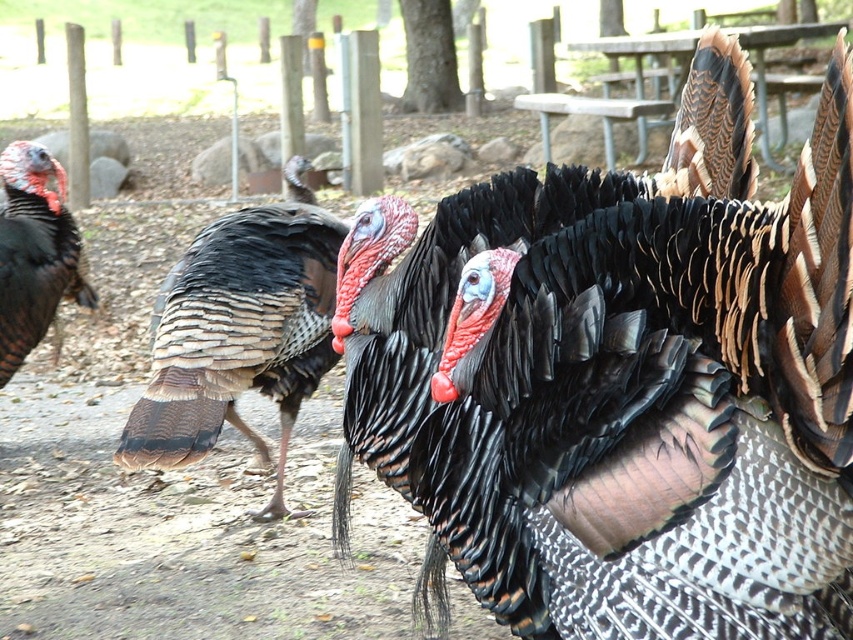
Question: Is shiny black feathers at center closer to camera compared to matte black turkey at left?

Choices:
 (A) no
 (B) yes

Answer: (B)

Question: Which object is closer to the camera taking this photo?

Choices:
 (A) shiny black feathers at center
 (B) speckled feathered turkey at center

Answer: (A)

Question: Among these points, which one is farthest from the camera?

Choices:
 (A) (16, 214)
 (B) (666, 292)
 (C) (219, 256)

Answer: (A)

Question: Where is shiny black feathers at center located in relation to speckled feathered turkey at center in the image?

Choices:
 (A) above
 (B) below

Answer: (A)

Question: Based on their relative distances, which object is nearer to the matte black turkey at left?

Choices:
 (A) shiny black feathers at center
 (B) speckled feathered turkey at center

Answer: (B)

Question: Can you confirm if shiny black feathers at center is positioned to the left of speckled feathered turkey at center?

Choices:
 (A) no
 (B) yes

Answer: (A)